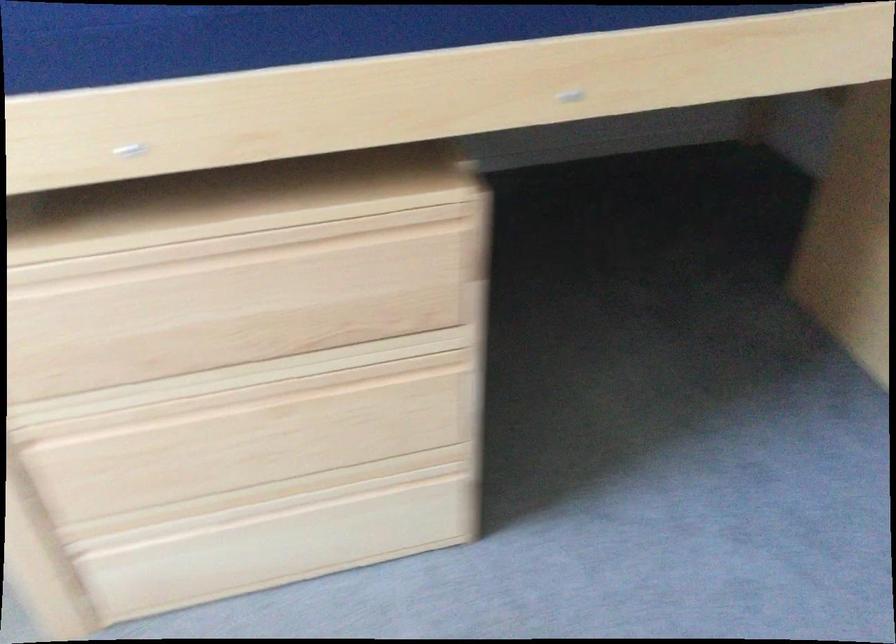
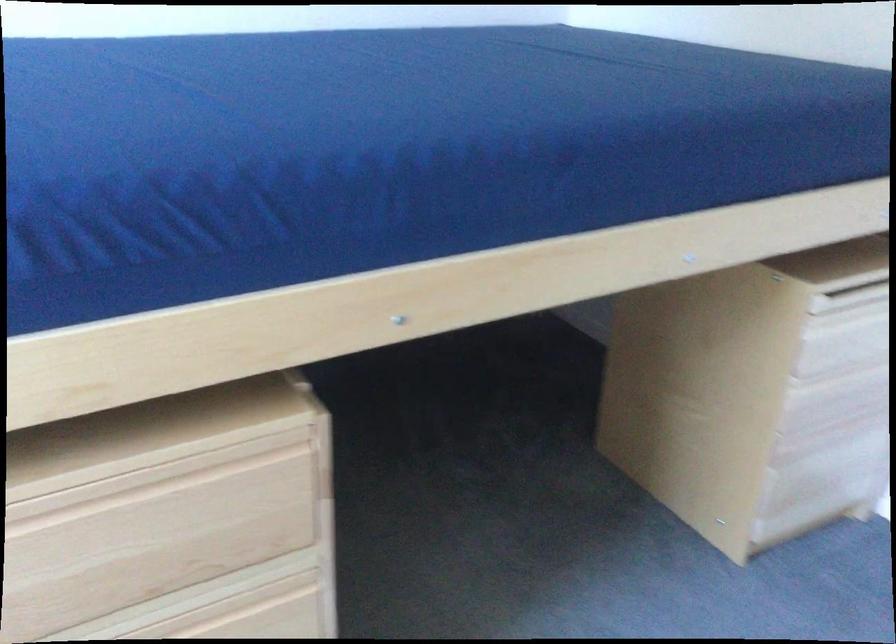
What movement of the cameraman would produce the second image?

The cameraman moved toward left, backward.